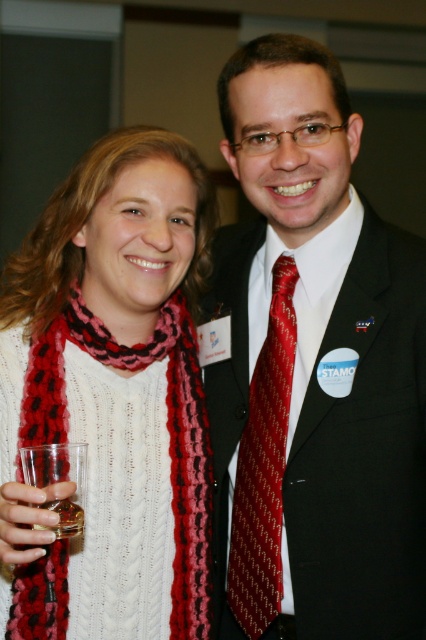
Measure the distance from shiny silk tie at center to clear plastic glass at lower left.

shiny silk tie at center is 14.95 inches from clear plastic glass at lower left.

Does point (256, 416) come in front of point (78, 486)?

No, (256, 416) is behind (78, 486).

Locate an element on the screen. The image size is (426, 640). shiny silk tie at center is located at coordinates (264, 467).

What are the coordinates of `shiny red tie at center` in the screenshot? It's located at (313, 369).

Is point (313, 317) farther from viewer compared to point (57, 621)?

Yes.

This screenshot has height=640, width=426. What are the coordinates of `shiny red tie at center` in the screenshot? It's located at (313, 369).

Who is higher up, shiny red tie at center or shiny silk tie at center?

Positioned higher is shiny red tie at center.

Between point (301, 330) and point (290, 328), which one is positioned behind?

Point (290, 328)

Where is `shiny red tie at center`? The image size is (426, 640). shiny red tie at center is located at coordinates (313, 369).